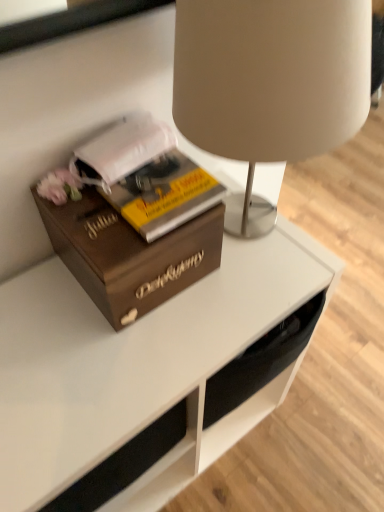
Find the location of a particular element. The image size is (384, 512). blank space situated above yellow matte book at center (from a real-world perspective) is located at coordinates (150, 184).